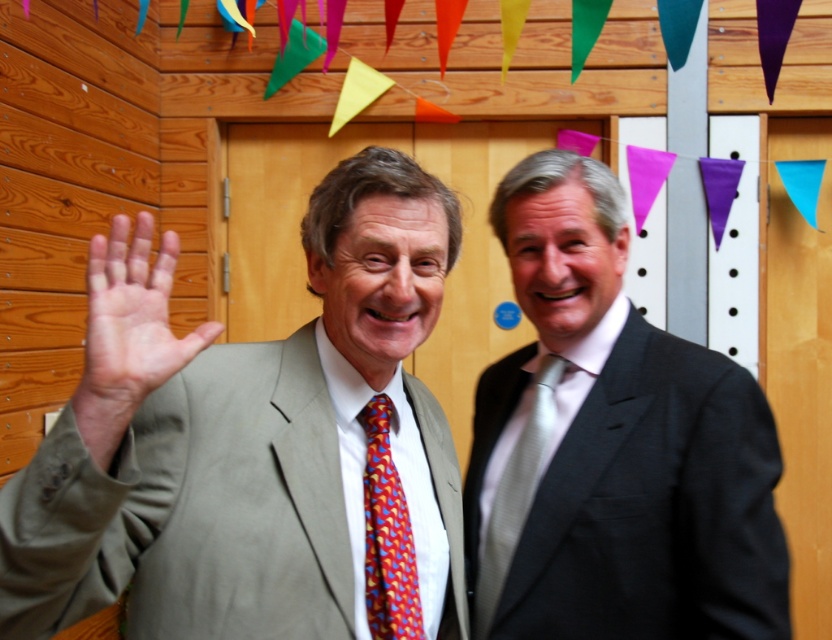
Question: Is dark gray suit at right behind multicolored silk tie at center?

Choices:
 (A) yes
 (B) no

Answer: (A)

Question: Which object appears farthest from the camera in this image?

Choices:
 (A) light skin palm at center
 (B) matte gray suit at left
 (C) dark gray suit at right
 (D) silky silver tie at right

Answer: (D)

Question: Is light skin palm at center behind multicolored silk tie at center?

Choices:
 (A) yes
 (B) no

Answer: (B)

Question: Does dark gray suit at right have a larger size compared to silky silver tie at right?

Choices:
 (A) yes
 (B) no

Answer: (A)

Question: Among these points, which one is farthest from the camera?

Choices:
 (A) (131, 266)
 (B) (553, 417)
 (C) (370, 413)

Answer: (B)

Question: Based on their relative distances, which object is farther from the multicolored silk tie at center?

Choices:
 (A) light skin palm at center
 (B) dark gray suit at right
 (C) matte gray suit at left

Answer: (A)